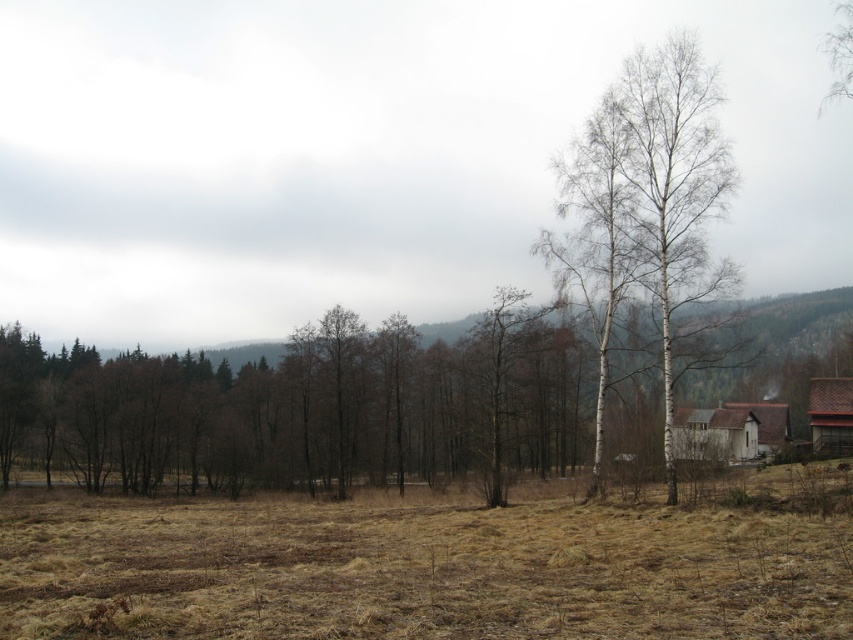
You are standing at the origin point in the image coordinate system. Where is the brown grass at center located in terms of its 2D coordinates?

The brown grass at center is located at the 2D coordinates of point (428, 566).

You are standing at the edge of the field in the image and want to walk towards the white wooden house at lower right and the brown wooden barn at lower right. Which one will you reach first?

The brown wooden barn at lower right will be reached first because it is positioned below the white wooden house at lower right, making it closer to your starting point at the field edge.